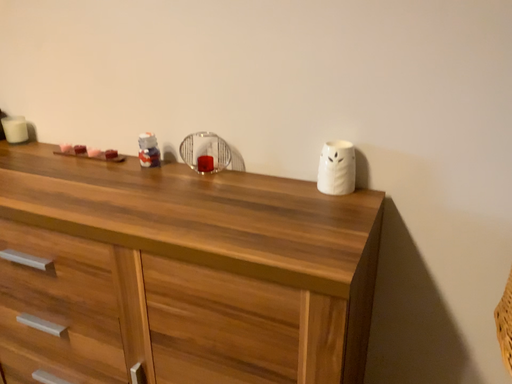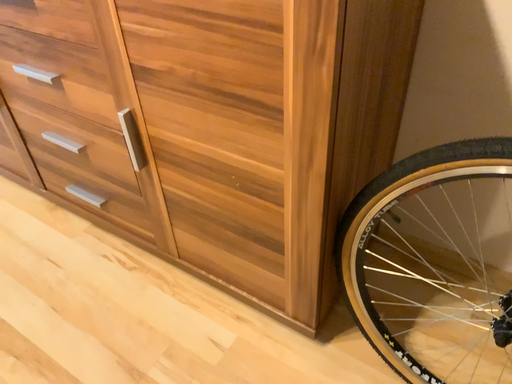
Question: How did the camera likely rotate when shooting the video?

Choices:
 (A) rotated downward
 (B) rotated upward

Answer: (A)